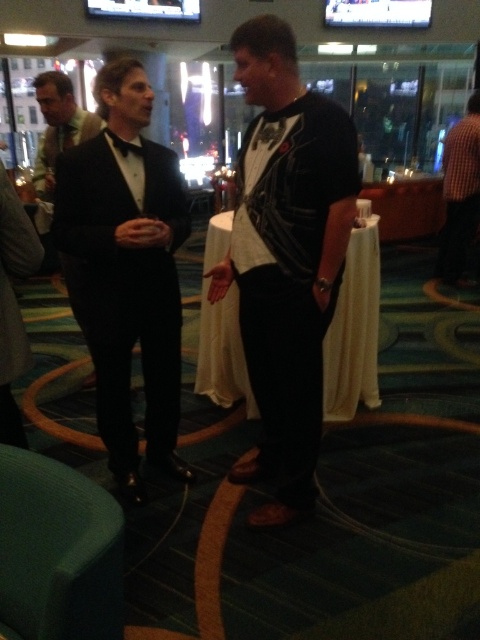
Between leather jacket at center and checkered fabric shirt at right, which one appears on the left side from the viewer's perspective?

Positioned to the left is leather jacket at center.

Who is taller, leather jacket at center or checkered fabric shirt at right?

leather jacket at center

You are a GUI agent. You are given a task and a screenshot of the screen. Output one action in this format:
    pyautogui.click(x=<x>, y=<y>)
    Task: Click on the leather jacket at center
    This screenshot has width=480, height=640.
    Given the screenshot: What is the action you would take?
    pyautogui.click(x=286, y=257)

The height and width of the screenshot is (640, 480). In order to click on leather jacket at center in this screenshot , I will do `click(286, 257)`.

Is point (476, 163) farther from viewer compared to point (50, 157)?

Yes, point (476, 163) is behind point (50, 157).

The image size is (480, 640). I want to click on checkered fabric shirt at right, so click(459, 193).

Who is more distant from viewer, (448, 147) or (74, 140)?

The point (448, 147) is behind.

Locate an element on the screen. Image resolution: width=480 pixels, height=640 pixels. checkered fabric shirt at right is located at coordinates (459, 193).

Between black satin tuxedo at left and matte black suit at left, which one is positioned higher?

matte black suit at left is above.

Consider the image. Who is taller, black satin tuxedo at left or matte black suit at left?

black satin tuxedo at left is taller.

Which is in front, point (126, 176) or point (72, 99)?

Point (126, 176)

You are a GUI agent. You are given a task and a screenshot of the screen. Output one action in this format:
    pyautogui.click(x=<x>, y=<y>)
    Task: Click on the black satin tuxedo at left
    Image resolution: width=480 pixels, height=640 pixels.
    Given the screenshot: What is the action you would take?
    pyautogui.click(x=126, y=269)